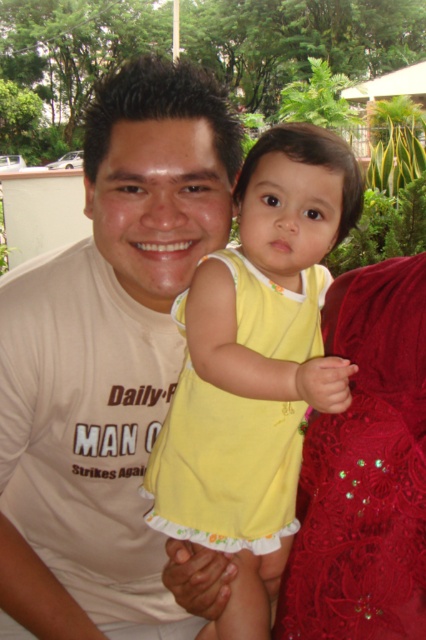
Does matte beige t-shirt at center have a greater height compared to yellow fabric dress at center?

Correct, matte beige t-shirt at center is much taller as yellow fabric dress at center.

Does point (26, 321) lie in front of point (262, 627)?

Yes, it is in front of point (262, 627).

This screenshot has height=640, width=426. Identify the location of matte beige t-shirt at center. (108, 355).

Is matte beige t-shirt at center further to camera compared to velvet red dress at right?

Yes.

Between matte beige t-shirt at center and velvet red dress at right, which one appears on the right side from the viewer's perspective?

velvet red dress at right is more to the right.

The width and height of the screenshot is (426, 640). Describe the element at coordinates (108, 355) in the screenshot. I see `matte beige t-shirt at center` at that location.

Where is `matte beige t-shirt at center`? This screenshot has width=426, height=640. matte beige t-shirt at center is located at coordinates (108, 355).

Which is more to the right, yellow fabric dress at center or velvet red dress at right?

Positioned to the right is velvet red dress at right.

Who is lower down, yellow fabric dress at center or velvet red dress at right?

velvet red dress at right is lower down.

Identify the location of yellow fabric dress at center. The height and width of the screenshot is (640, 426). (256, 365).